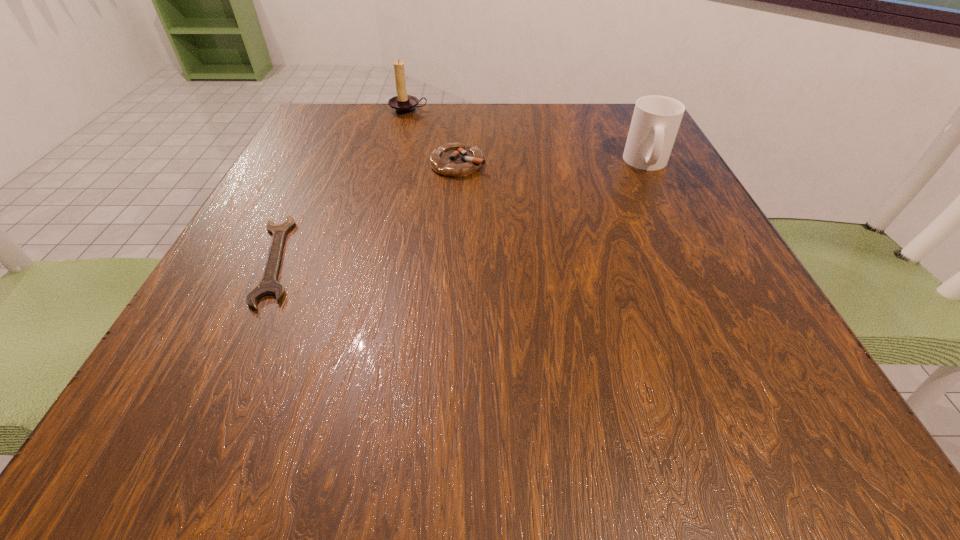
In the image, there is a desktop. Identify the location of vacant space at the far left corner. The width and height of the screenshot is (960, 540). (321, 134).

Identify the location of free location at the near left corner of the desktop. (160, 426).

The height and width of the screenshot is (540, 960). In the image, there is a desktop. Find the location of `free space at the far right corner`. free space at the far right corner is located at coordinates (594, 113).

The height and width of the screenshot is (540, 960). I want to click on vacant space at the near right corner of the desktop, so click(806, 404).

Where is `vacant space that is in between the farthest object and the shortest object`? The height and width of the screenshot is (540, 960). vacant space that is in between the farthest object and the shortest object is located at coordinates pos(342,185).

The image size is (960, 540). I want to click on free space between the nearest object and the candle holder, so click(x=342, y=185).

Identify the location of free point between the ashtray and the candle holder. (433, 137).

Where is `vacant space that is in between the second shortest object and the rightmost object`? The width and height of the screenshot is (960, 540). vacant space that is in between the second shortest object and the rightmost object is located at coordinates (552, 163).

At what (x,y) coordinates should I click in order to perform the action: click on vacant space that is in between the rightmost object and the leftmost object. Please return your answer as a coordinate pair (x, y). This screenshot has height=540, width=960. Looking at the image, I should click on (461, 211).

Where is `vacant point located between the third tallest object and the mug`? The image size is (960, 540). vacant point located between the third tallest object and the mug is located at coordinates (552, 163).